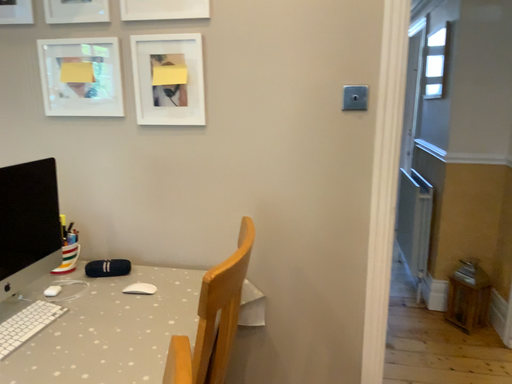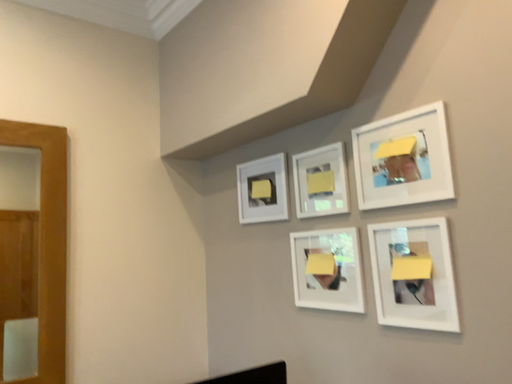
Question: Which way did the camera rotate in the video?

Choices:
 (A) rotated downward
 (B) rotated upward

Answer: (B)